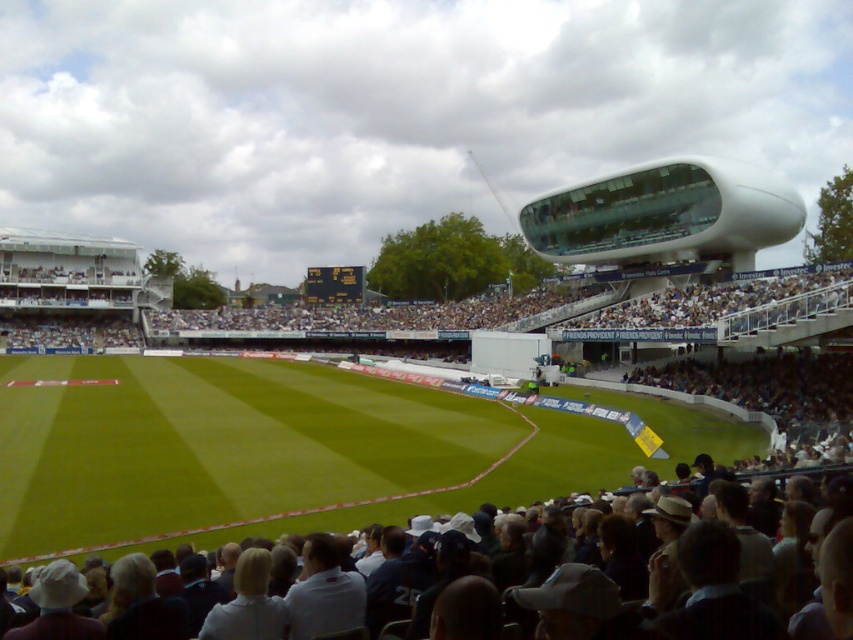
Question: Does green grass at center appear under dark gray fabric crowd at lower center?

Choices:
 (A) yes
 (B) no

Answer: (B)

Question: Which point is closer to the camera?

Choices:
 (A) tap(448, 577)
 (B) tap(538, 484)

Answer: (A)

Question: Does green grass at center lie behind dark gray fabric crowd at lower center?

Choices:
 (A) yes
 (B) no

Answer: (A)

Question: Which object is closer to the camera taking this photo?

Choices:
 (A) dark gray fabric crowd at lower center
 (B) green grass at center

Answer: (A)

Question: Does green grass at center come in front of dark gray fabric crowd at lower center?

Choices:
 (A) no
 (B) yes

Answer: (A)